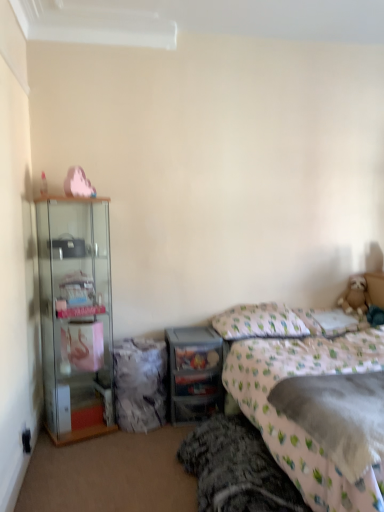
Question: Could you tell me if clear plastic drawers at center is facing fluffy beige teddy bear at right?

Choices:
 (A) yes
 (B) no

Answer: (B)

Question: Is the surface of clear plastic drawers at center in direct contact with fluffy beige teddy bear at right?

Choices:
 (A) no
 (B) yes

Answer: (A)

Question: Is clear plastic drawers at center turned away from fluffy beige teddy bear at right?

Choices:
 (A) yes
 (B) no

Answer: (B)

Question: Is clear plastic drawers at center not within fluffy beige teddy bear at right?

Choices:
 (A) yes
 (B) no

Answer: (A)

Question: Does clear plastic drawers at center have a greater height compared to fluffy beige teddy bear at right?

Choices:
 (A) no
 (B) yes

Answer: (B)

Question: Considering the positions of fluffy gray blanket at lower center and clear glass cabinet at left in the image, is fluffy gray blanket at lower center wider or thinner than clear glass cabinet at left?

Choices:
 (A) wide
 (B) thin

Answer: (A)

Question: Choose the correct answer: Is fluffy gray blanket at lower center inside clear glass cabinet at left or outside it?

Choices:
 (A) outside
 (B) inside

Answer: (A)

Question: In terms of height, does fluffy gray blanket at lower center look taller or shorter compared to clear glass cabinet at left?

Choices:
 (A) short
 (B) tall

Answer: (A)

Question: Considering their positions, is fluffy gray blanket at lower center located in front of or behind clear glass cabinet at left?

Choices:
 (A) front
 (B) behind

Answer: (A)

Question: Looking at their shapes, would you say white fabric pillow at upper right, positioned as the second pillow in left-to-right order, is wider or thinner than white fabric pillow at center, the second pillow positioned from the right?

Choices:
 (A) wide
 (B) thin

Answer: (B)

Question: Considering the relative positions of white fabric pillow at upper right, which is the 1th pillow in right-to-left order, and white fabric pillow at center, the second pillow positioned from the right, in the image provided, is white fabric pillow at upper right, which is the 1th pillow in right-to-left order, to the left or to the right of white fabric pillow at center, the second pillow positioned from the right,?

Choices:
 (A) right
 (B) left

Answer: (A)

Question: Considering the positions of point (316, 313) and point (236, 337), is point (316, 313) closer or farther from the camera than point (236, 337)?

Choices:
 (A) closer
 (B) farther

Answer: (B)

Question: From their relative heights in the image, would you say white fabric pillow at upper right, which is the 1th pillow in right-to-left order, is taller or shorter than white fabric pillow at center, which is counted as the first pillow, starting from the left?

Choices:
 (A) tall
 (B) short

Answer: (A)

Question: In terms of width, does fluffy pink blanket at lower right look wider or thinner when compared to white fabric pillow at center, which is counted as the first pillow, starting from the left?

Choices:
 (A) thin
 (B) wide

Answer: (B)

Question: From a real-world perspective, is fluffy pink blanket at lower right positioned above or below white fabric pillow at center, the second pillow positioned from the right?

Choices:
 (A) below
 (B) above

Answer: (A)